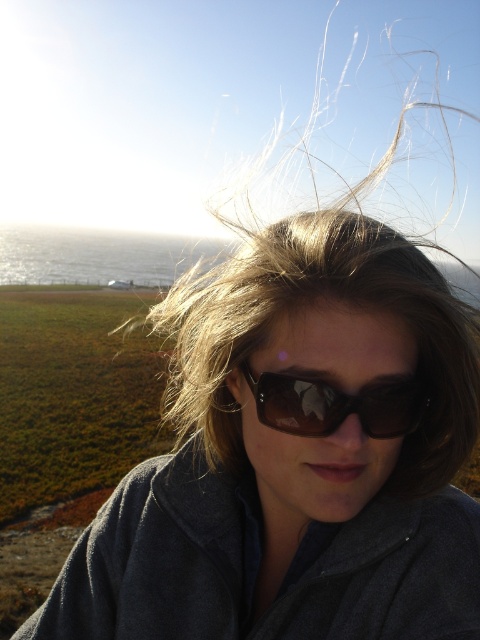
Does blonde hair at center come in front of brown reflective sunglasses at center?

That is False.

Who is more distant from viewer, (x=425, y=337) or (x=279, y=378)?

The point (x=425, y=337) is behind.

Between point (417, 332) and point (313, 428), which one is positioned behind?

Point (417, 332)

Where is `blonde hair at center`? blonde hair at center is located at coordinates (325, 298).